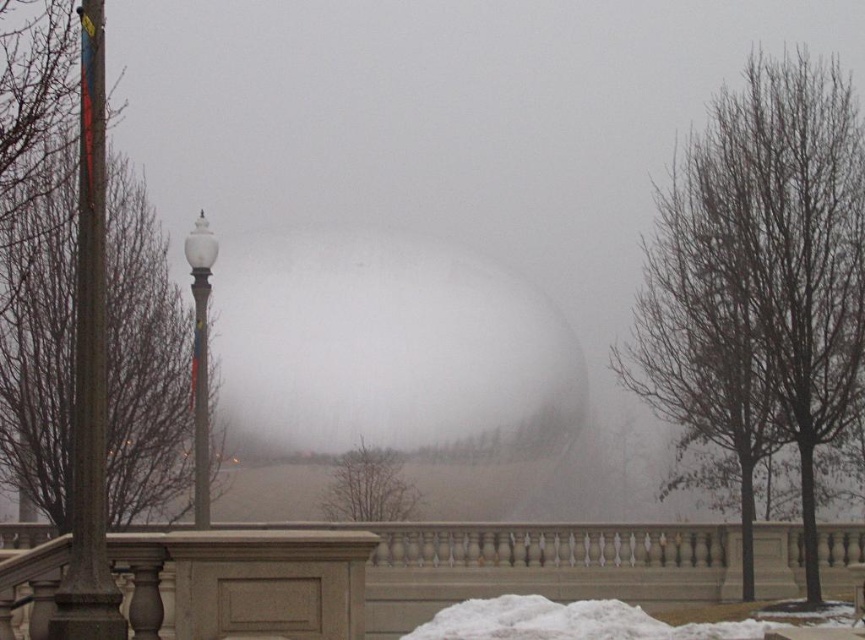
Who is shorter, smooth stone balustrade at lower center or metallic gray pole at center?

metallic gray pole at center

You are a GUI agent. You are given a task and a screenshot of the screen. Output one action in this format:
    pyautogui.click(x=<x>, y=<y>)
    Task: Click on the smooth stone balustrade at lower center
    The width and height of the screenshot is (865, 640).
    Given the screenshot: What is the action you would take?
    pyautogui.click(x=535, y=564)

Does white matte fog at center have a lesser width compared to white fluffy snow at lower center?

No, white matte fog at center is not thinner than white fluffy snow at lower center.

Is white matte fog at center bigger than white fluffy snow at lower center?

Yes, white matte fog at center is bigger than white fluffy snow at lower center.

Describe the element at coordinates (386, 348) in the screenshot. This screenshot has width=865, height=640. I see `white matte fog at center` at that location.

Identify the location of white matte fog at center. (386, 348).

Is point (69, 490) in front of point (202, 484)?

No, it is behind (202, 484).

Is the position of brown leafless tree at left more distant than that of white glossy lamp post at left?

No, it is in front of white glossy lamp post at left.

What are the coordinates of `brown leafless tree at left` in the screenshot? It's located at (144, 362).

This screenshot has height=640, width=865. Identify the location of brown leafless tree at left. (144, 362).